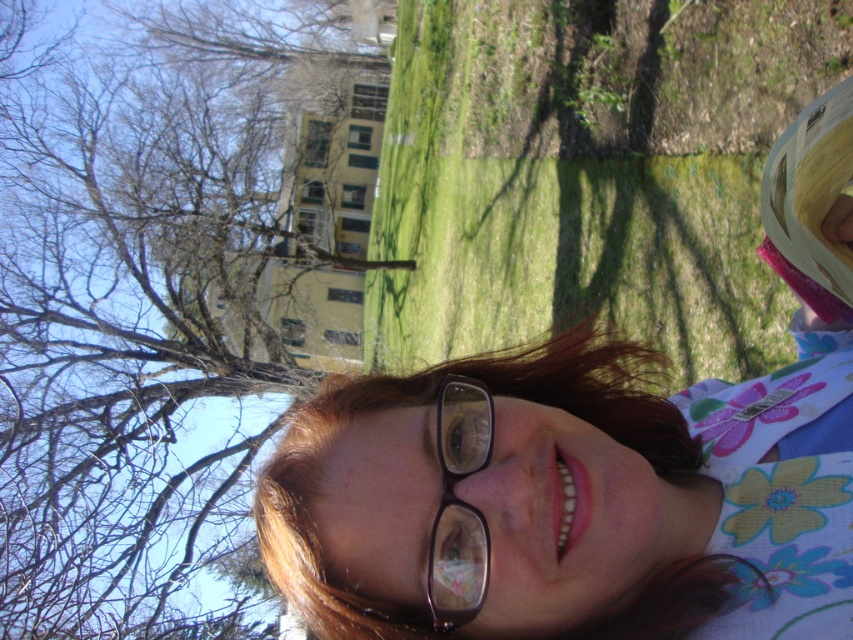
Between bare branches at upper left and black plastic glasses at center, which one is positioned lower?

Positioned lower is black plastic glasses at center.

Is bare branches at upper left taller than black plastic glasses at center?

Indeed, bare branches at upper left has a greater height compared to black plastic glasses at center.

Is point (312, 83) positioned behind point (448, 477)?

Yes, it is.

Locate an element on the screen. This screenshot has height=640, width=853. bare branches at upper left is located at coordinates (167, 291).

Can you confirm if bare branches at upper left is positioned below matte black glasses at center?

Incorrect, bare branches at upper left is not positioned below matte black glasses at center.

Locate an element on the screen. bare branches at upper left is located at coordinates (167, 291).

Which of these two, matte black glasses at center or black plastic glasses at center, stands taller?

With more height is matte black glasses at center.

Who is positioned more to the left, matte black glasses at center or black plastic glasses at center?

From the viewer's perspective, black plastic glasses at center appears more on the left side.

Between point (625, 406) and point (471, 605), which one is positioned in front?

Point (471, 605)

Find the location of a particular element. matte black glasses at center is located at coordinates pyautogui.click(x=564, y=500).